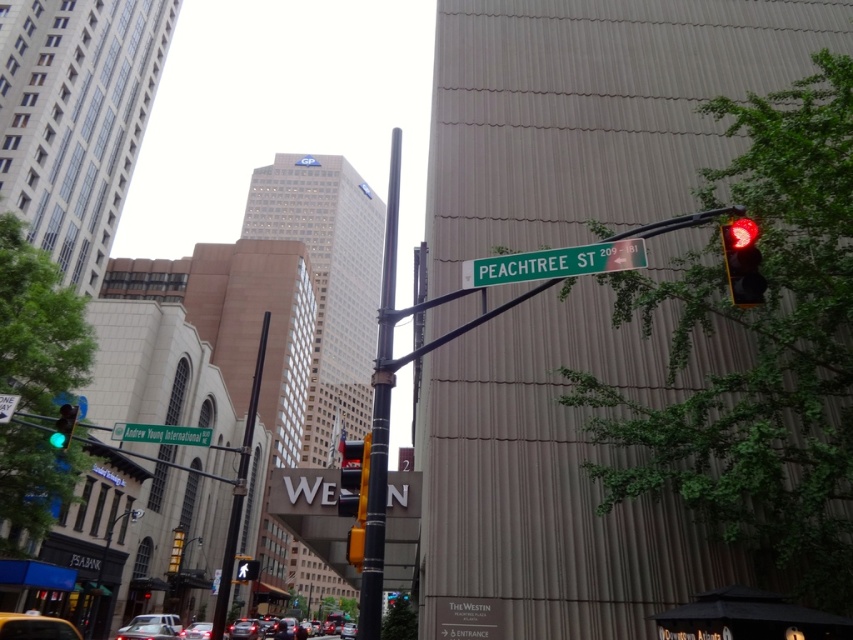
Question: Can you confirm if green metallic street sign at upper left is positioned to the left of shiny silver sedan at center?

Choices:
 (A) no
 (B) yes

Answer: (A)

Question: Is metallic pole at center below red glass pedestrian signal at center?

Choices:
 (A) no
 (B) yes

Answer: (A)

Question: Which of the following is the farthest from the observer?

Choices:
 (A) shiny silver sedan at center
 (B) matte red traffic light at upper right

Answer: (A)

Question: Which of the following is the closest to the observer?

Choices:
 (A) (138, 618)
 (B) (241, 448)
 (C) (643, 244)
 (D) (1, 404)

Answer: (C)

Question: Does yellow glass traffic light at center lie behind green matte tree at lower center?

Choices:
 (A) no
 (B) yes

Answer: (A)

Question: Estimate the real-world distances between objects in this image. Which object is closer to the metallic silver sedan at lower center?

Choices:
 (A) matte silver sedan at center
 (B) green glass traffic light at left
 (C) red glass pedestrian signal at center
 (D) metallic pole at center

Answer: (A)